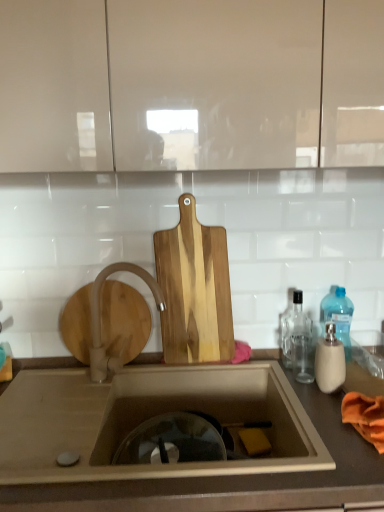
Where is `free space that is in between transparent glass bottle at right, which ranks as the 2th bottle in back-to-front order, and natural wood cutting board at center`? This screenshot has height=512, width=384. free space that is in between transparent glass bottle at right, which ranks as the 2th bottle in back-to-front order, and natural wood cutting board at center is located at coordinates (252, 362).